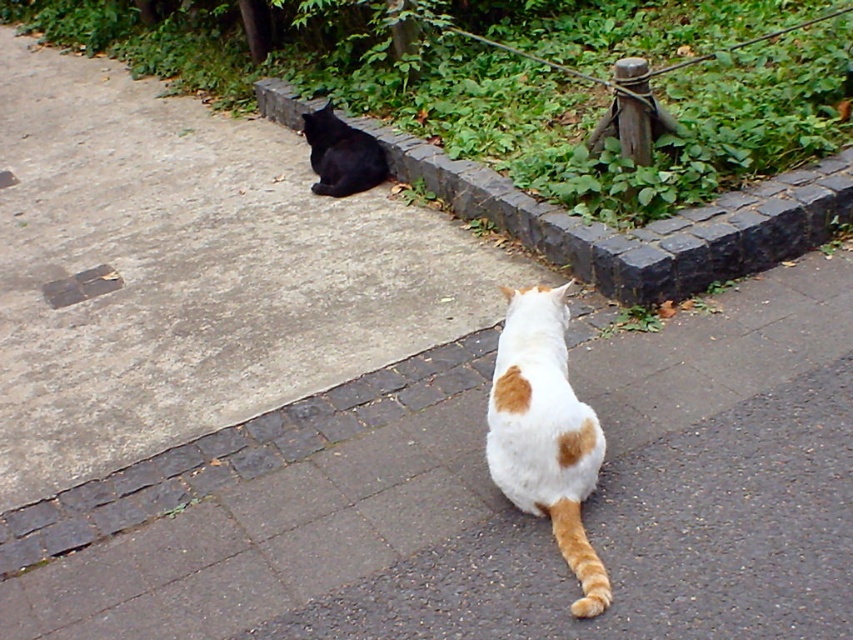
Based on the photo, you are a photographer trying to capture both the gray stone curb at upper center and the white and orange fur cat at center in the same frame. Based on their sizes, which object would appear larger in the photo?

The gray stone curb at upper center would appear larger in the photo because it is much taller than the white and orange fur cat at center.

You are a cat owner trying to decide which cat to approach first. The white and orange fur cat at center is sitting on a dark gray cobblestone surface, while the shiny black cat at upper left is on a lighter concrete area. Considering their sizes, which cat might be easier to spot from a distance?

The white and orange fur cat at center is larger in size compared to the shiny black cat at upper left, so it would be easier to spot from a distance due to its bigger size.

You are a photographer trying to capture both cats in a single shot. Given that the white and orange fur cat at center is taller than the shiny black cat at upper left, which cat should you focus on first to ensure both are in frame?

You should focus on the white and orange fur cat at center first because it is taller and positioned centrally, ensuring the shiny black cat at upper left will naturally fall into the frame as it is smaller and located at the upper left.